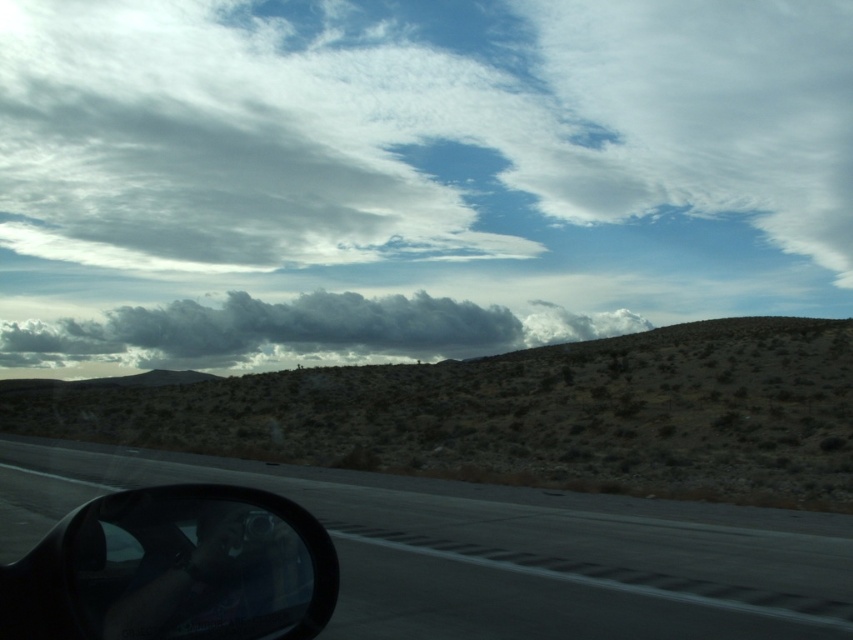
Is black glossy side mirror at lower left below dark gray fluffy cloud at center?

Yes.

What do you see at coordinates (173, 570) in the screenshot? The image size is (853, 640). I see `black glossy side mirror at lower left` at bounding box center [173, 570].

At what (x,y) coordinates should I click in order to perform the action: click on black glossy side mirror at lower left. Please return your answer as a coordinate pair (x, y). The height and width of the screenshot is (640, 853). Looking at the image, I should click on (173, 570).

Can you confirm if asphalt road at lower left is wider than dark gray fluffy cloud at center?

In fact, asphalt road at lower left might be narrower than dark gray fluffy cloud at center.

You are a GUI agent. You are given a task and a screenshot of the screen. Output one action in this format:
    pyautogui.click(x=<x>, y=<y>)
    Task: Click on the asphalt road at lower left
    
    Given the screenshot: What is the action you would take?
    pyautogui.click(x=502, y=552)

Find the location of a particular element. asphalt road at lower left is located at coordinates (502, 552).

Which is more to the left, brown/dry grassy hill at center or dark gray fluffy cloud at center?

dark gray fluffy cloud at center is more to the left.

Can you confirm if brown/dry grassy hill at center is thinner than dark gray fluffy cloud at center?

Correct, brown/dry grassy hill at center's width is less than dark gray fluffy cloud at center's.

Is point (444, 394) positioned before point (277, 353)?

Yes, point (444, 394) is in front of point (277, 353).

Locate an element on the screen. The image size is (853, 640). brown/dry grassy hill at center is located at coordinates (518, 413).